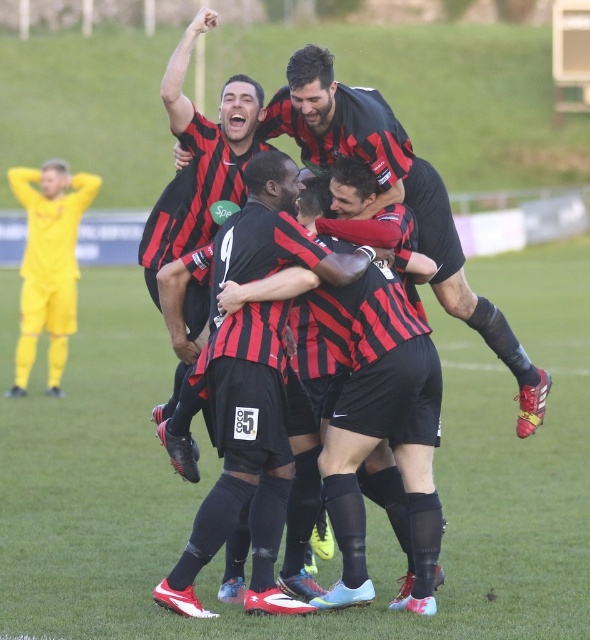
Is matte black soccer players at center positioned before yellow jersey at left?

That is True.

Which is in front, point (369, 241) or point (40, 273)?

Point (369, 241)

Between point (343, 227) and point (35, 266), which one is positioned behind?

The point (35, 266) is more distant.

Identify the location of matte black soccer players at center. The image size is (590, 640). (394, 195).

Is green grass at center shorter than matte black soccer players at center?

Incorrect, green grass at center's height does not fall short of matte black soccer players at center's.

Which is in front, point (555, 266) or point (326, 148)?

Point (326, 148)

The height and width of the screenshot is (640, 590). I want to click on green grass at center, so click(x=366, y=499).

Locate an element on the screen. The width and height of the screenshot is (590, 640). green grass at center is located at coordinates (366, 499).

The height and width of the screenshot is (640, 590). Describe the element at coordinates (366, 499) in the screenshot. I see `green grass at center` at that location.

Between green grass at center and matte black shorts at center, which one is positioned lower?

Positioned lower is matte black shorts at center.

Is point (217, 566) closer to camera compared to point (431, 573)?

No.

Image resolution: width=590 pixels, height=640 pixels. What are the coordinates of `green grass at center` in the screenshot? It's located at (366, 499).